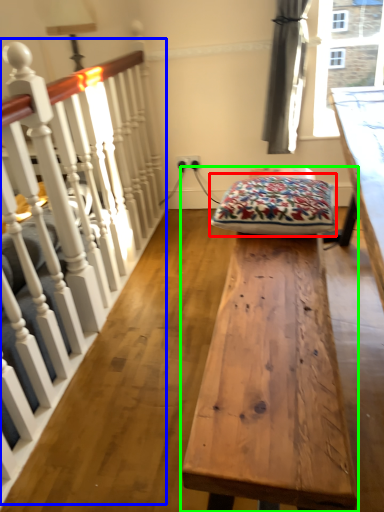
Question: Estimate the real-world distances between objects in this image. Which object is closer to blanket (highlighted by a red box), rail (highlighted by a blue box) or table (highlighted by a green box)?

Choices:
 (A) rail
 (B) table

Answer: (B)